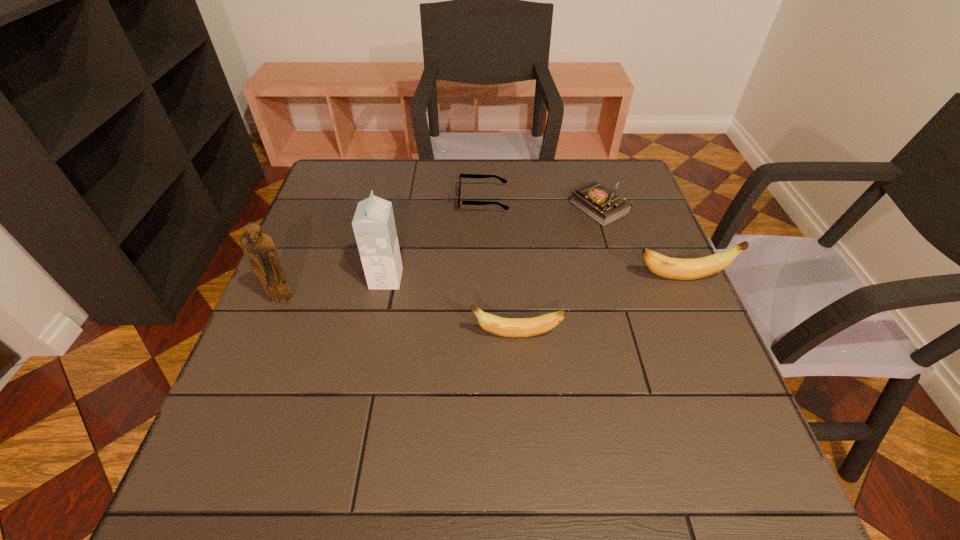
What are the coordinates of `free area in between the farther banana and the nearest object` in the screenshot? It's located at (599, 307).

The image size is (960, 540). Find the location of `free spot between the farther banana and the figurine`. free spot between the farther banana and the figurine is located at coordinates (483, 289).

The width and height of the screenshot is (960, 540). What are the coordinates of `vacant region between the farther banana and the spectacles` in the screenshot? It's located at (583, 239).

Identify the location of blank region between the leftmost object and the carton. This screenshot has height=540, width=960. (335, 289).

In order to click on empty location between the right banana and the fifth object from right to left in this screenshot , I will do `click(534, 278)`.

I want to click on free space between the spectacles and the left banana, so click(x=500, y=268).

The width and height of the screenshot is (960, 540). In order to click on unoccupied area between the right banana and the figurine in this screenshot , I will do `click(483, 289)`.

You are a GUI agent. You are given a task and a screenshot of the screen. Output one action in this format:
    pyautogui.click(x=<x>, y=<y>)
    Task: Click on the empty space that is in between the diary and the figurine
    The image size is (960, 540).
    Given the screenshot: What is the action you would take?
    pyautogui.click(x=442, y=254)

Find the location of `vacant area between the diary and the third tallest object`. vacant area between the diary and the third tallest object is located at coordinates (640, 243).

Select which object is the second closest to the third shortest object. Please provide its 2D coordinates. Your answer should be formatted as a tuple, i.e. [(x, y)], where the tuple contains the x and y coordinates of a point satisfying the conditions above.

[(674, 268)]